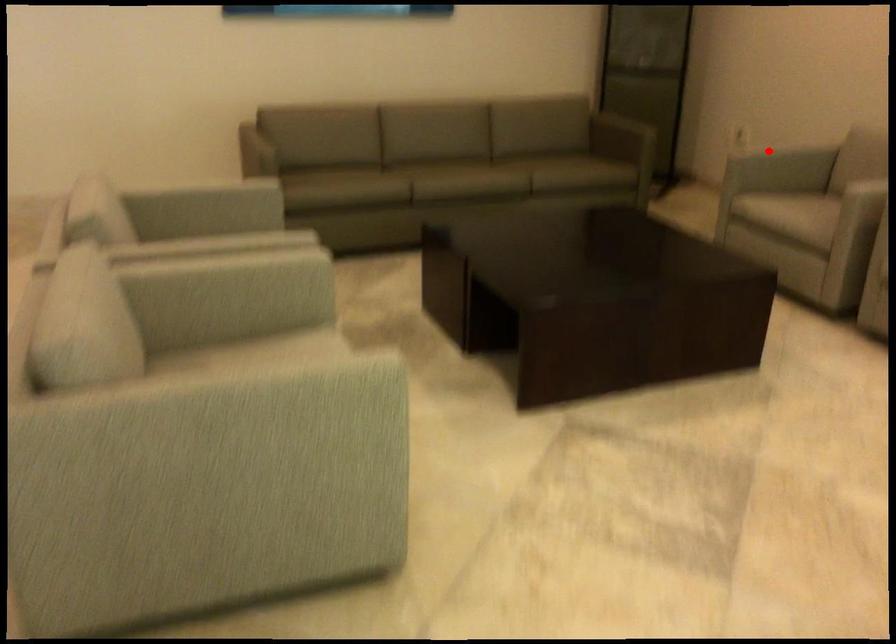
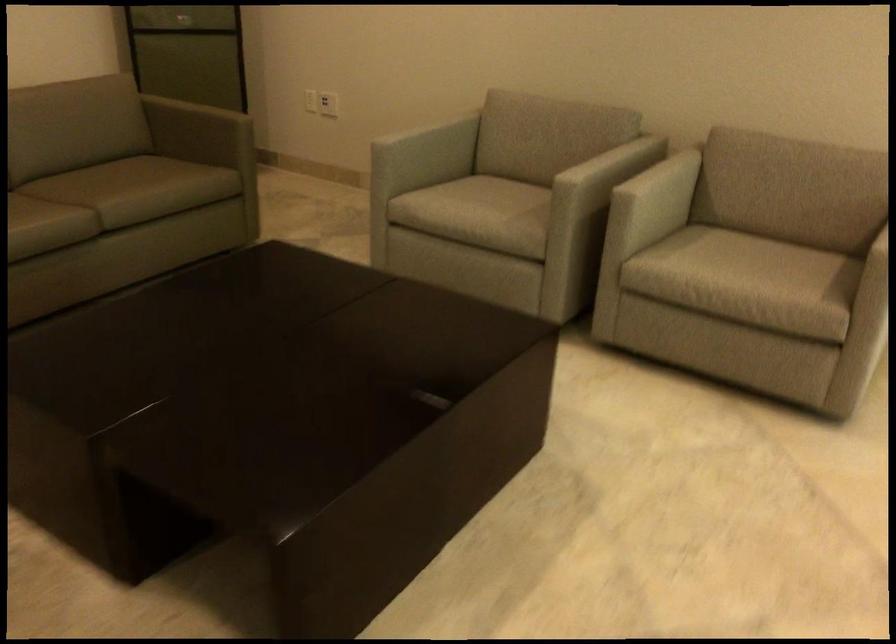
Question: I am providing you with two images of the same scene from different viewpoints. In image1, a red point is highlighted. Considering the same 3D point in image2, which of the following is correct?

Choices:
 (A) It is closer
 (B) It is farther

Answer: (A)